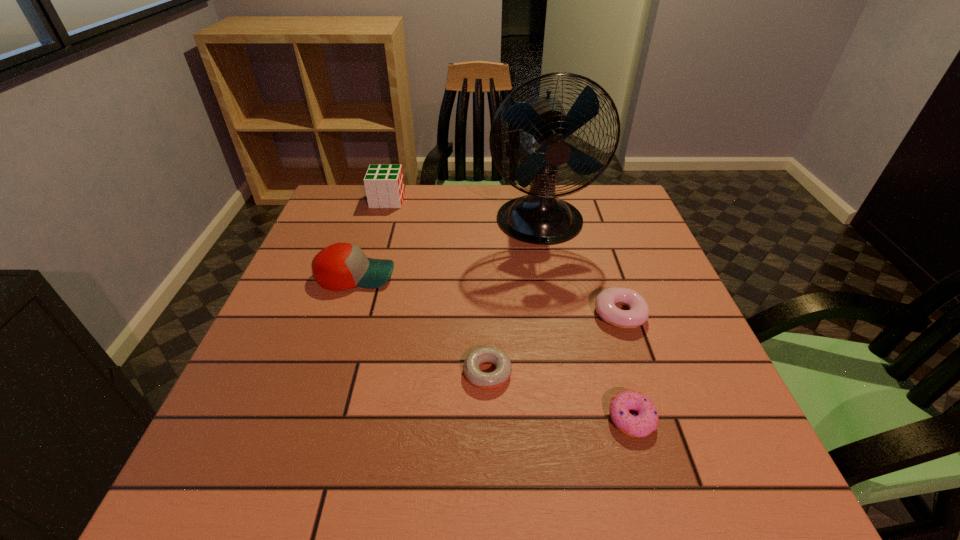
Identify the location of the tallest object. The width and height of the screenshot is (960, 540). (540, 217).

You are a GUI agent. You are given a task and a screenshot of the screen. Output one action in this format:
    pyautogui.click(x=<x>, y=<y>)
    Task: Click on the cube
    This screenshot has width=960, height=540.
    Given the screenshot: What is the action you would take?
    [x=384, y=184]

I want to click on the fourth nearest object, so click(x=341, y=266).

This screenshot has width=960, height=540. I want to click on the third tallest object, so click(341, 266).

Locate an element on the screen. This screenshot has height=540, width=960. the farthest doughnut is located at coordinates (605, 304).

Identify the location of the fourth farthest object. The width and height of the screenshot is (960, 540). (605, 304).

Find the location of `the nearest object`. the nearest object is located at coordinates (646, 422).

The image size is (960, 540). Find the location of `the second farthest doughnut`. the second farthest doughnut is located at coordinates (487, 381).

This screenshot has width=960, height=540. I want to click on the leftmost doughnut, so click(487, 381).

Find the location of a particular element. The height and width of the screenshot is (540, 960). free space located on the front-facing side of the tallest object is located at coordinates (549, 273).